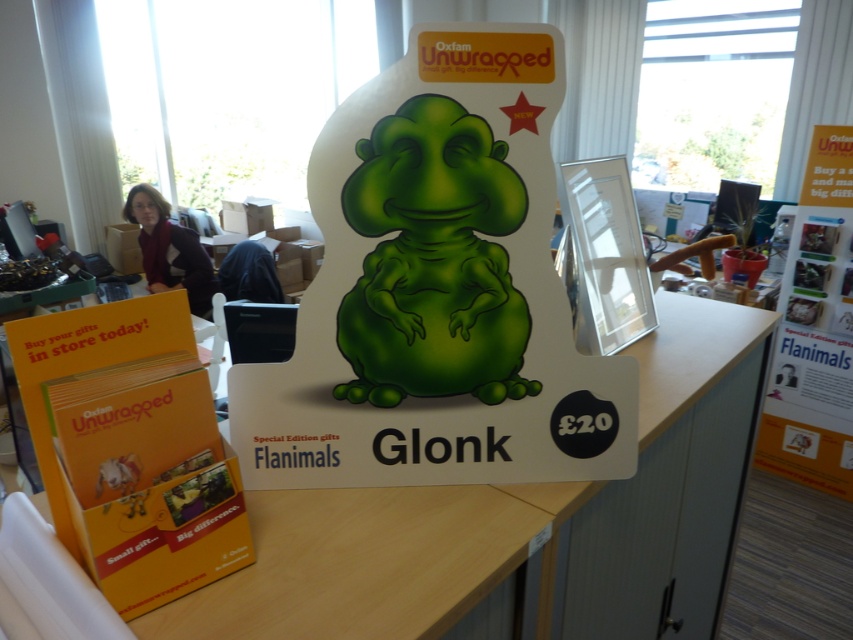
Question: Is white matte table at center positioned in front of white paper poster at upper right?

Choices:
 (A) no
 (B) yes

Answer: (B)

Question: From the image, what is the correct spatial relationship of white matte table at center in relation to white paper poster at upper right?

Choices:
 (A) above
 (B) below

Answer: (B)

Question: Can you confirm if white matte table at center is thinner than white paper poster at upper right?

Choices:
 (A) no
 (B) yes

Answer: (A)

Question: Among these objects, which one is nearest to the camera?

Choices:
 (A) white paper poster at upper right
 (B) white matte table at center

Answer: (B)